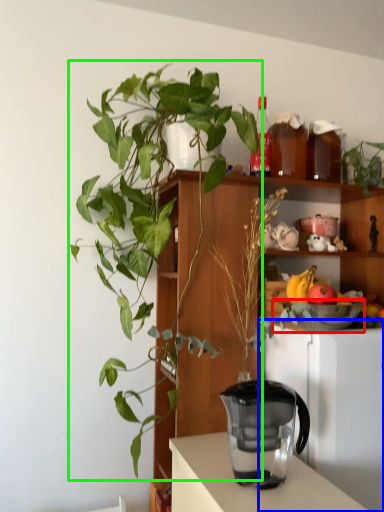
Question: Considering the real-world distances, which object is farthest from bowl (highlighted by a red box)? appliance (highlighted by a blue box) or houseplant (highlighted by a green box)?

Choices:
 (A) appliance
 (B) houseplant

Answer: (B)